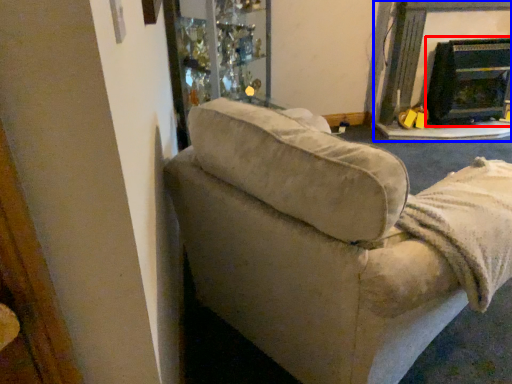
Question: Which object appears farthest to the camera in this image, fireplace (highlighted by a red box) or fireplace (highlighted by a blue box)?

Choices:
 (A) fireplace
 (B) fireplace

Answer: (A)